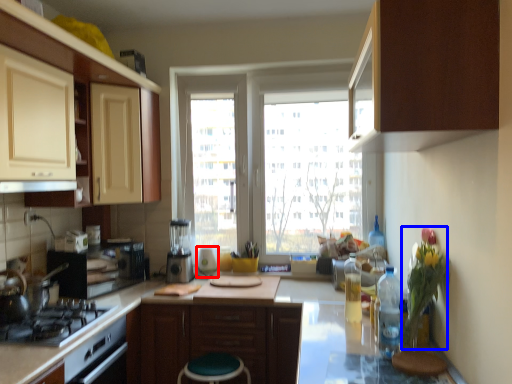
Question: Which point is further to the camera, appliance (highlighted by a red box) or flower (highlighted by a blue box)?

Choices:
 (A) appliance
 (B) flower

Answer: (A)